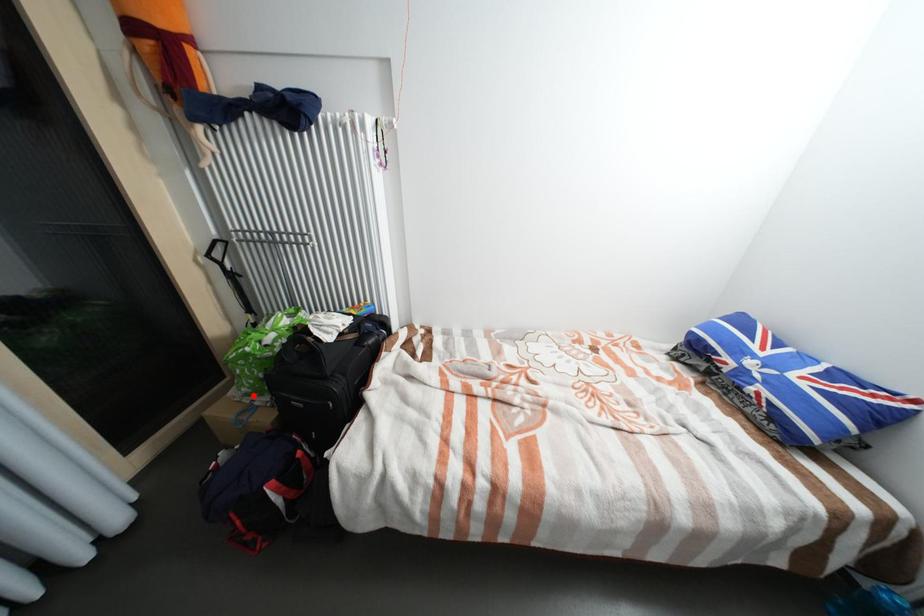
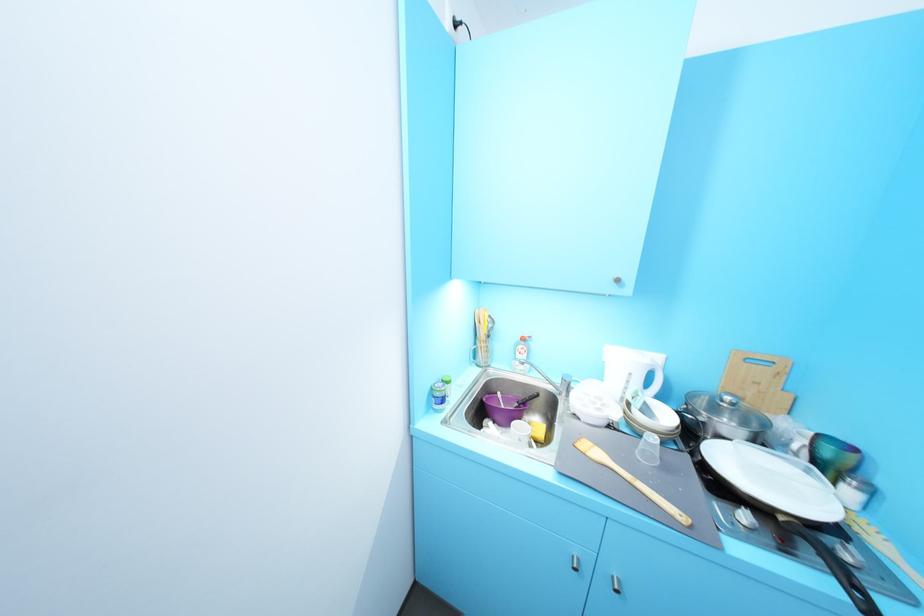
Question: I am providing you with two images of the same scene from different viewpoints. A red point is marked on the first image. Is the red point's position out of view in image 2?

Choices:
 (A) Yes
 (B) No

Answer: (A)